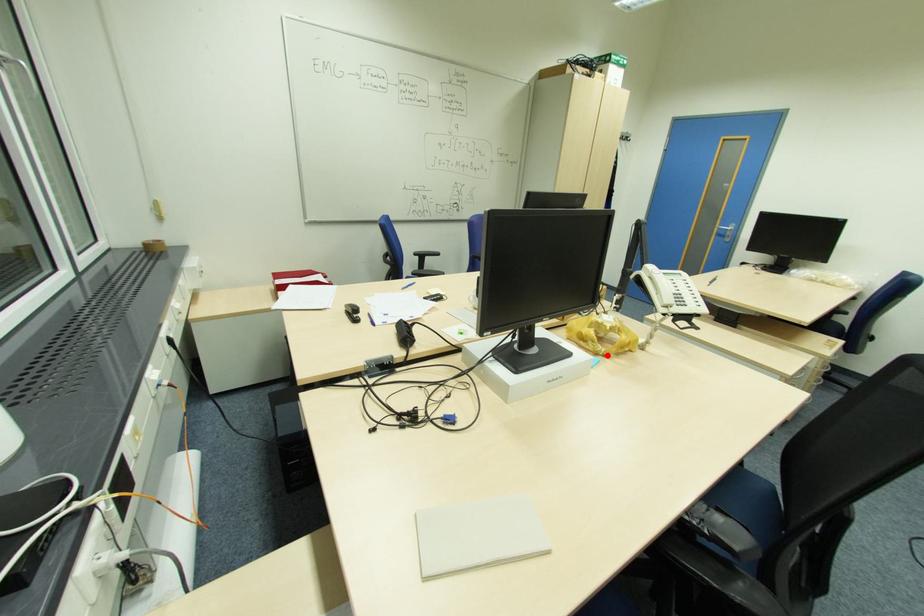
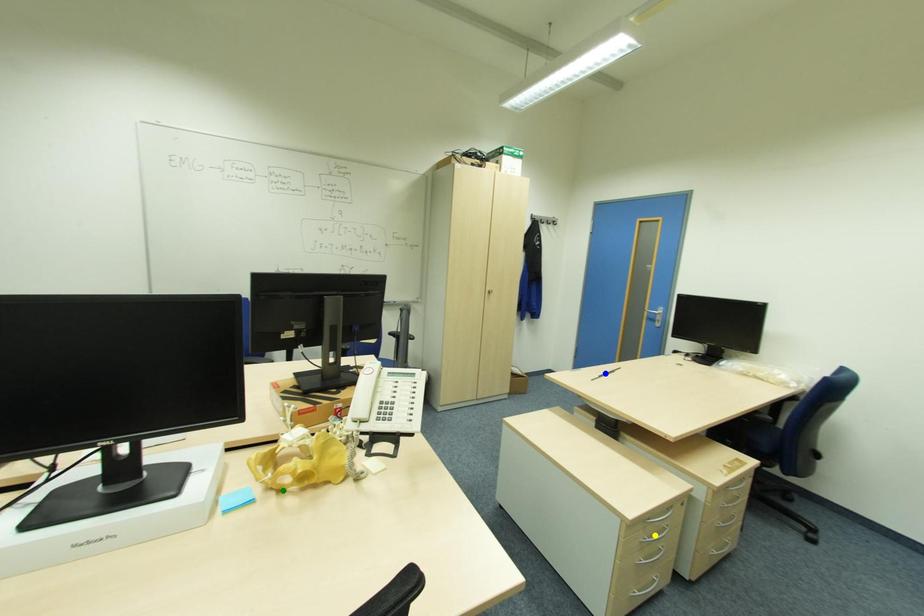
Question: I am providing you with two images of the same scene from different viewpoints. A red point is marked on the first image. You are given multiple points on the second image. Can you choose the point in image 2 that corresponds to the point in image 1?

Choices:
 (A) green point
 (B) blue point
 (C) yellow point

Answer: (A)